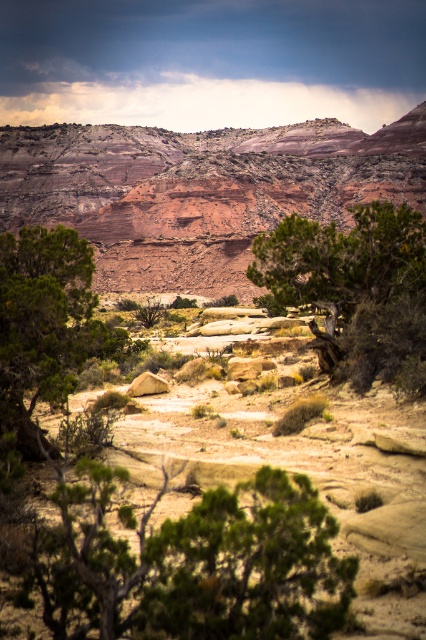
In the scene shown: You are standing at the center of the desert scene and want to reach the rustic sandstone mountain at center. According to the coordinates provided, in which direction should you head?

The rustic sandstone mountain at center is located at coordinates point (x=199, y=189), which means it is positioned slightly to the left and below your current position at the center. You should head slightly to the left and downward to reach it.

You are standing in the desert and see the rustic sandstone mountain at center and the green matte tree at left. Which object is higher in the scene?

The rustic sandstone mountain at center is higher than the green matte tree at left.

You are standing at the point with coordinates point (256,243) and want to walk towards the point (146,182). Based on the desert landscape described, will you be moving towards the foreground or the background?

You will be moving towards the background because point (146,182) is behind point (256,243).